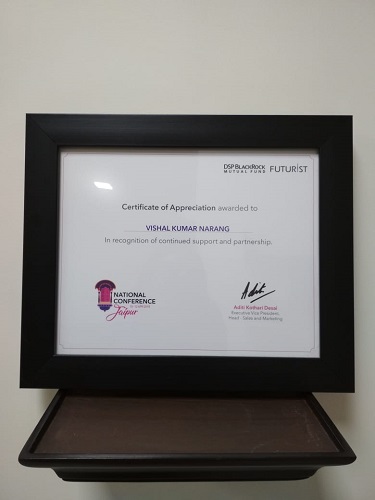
Identify the location of black picture frame. The height and width of the screenshot is (500, 375). (269, 137).